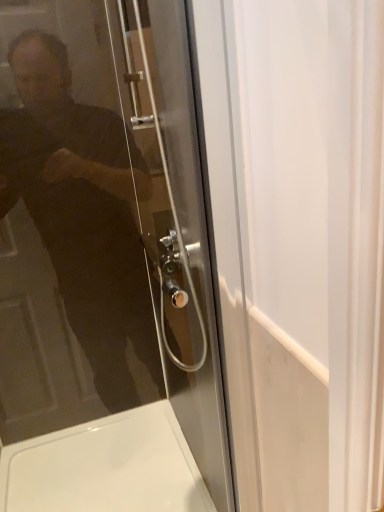
Identify the location of white glossy bath at lower left. (106, 467).

The width and height of the screenshot is (384, 512). Describe the element at coordinates (106, 467) in the screenshot. I see `white glossy bath at lower left` at that location.

In the scene shown: Measure the distance between white glossy bath at lower left and camera.

4.68 feet.

Describe the element at coordinates (104, 260) in the screenshot. I see `transparent glass door at upper left` at that location.

What is the approximate height of transparent glass door at upper left?

The height of transparent glass door at upper left is 1.06 meters.

In order to face transparent glass door at upper left, should I rotate leftwards or rightwards?

Rotate your view left by about 11.130°.

Find the location of `transparent glass door at upper left`. transparent glass door at upper left is located at coordinates (104, 260).

Identify the location of white glossy bath at lower left. (106, 467).

Can you confirm if transparent glass door at upper left is positioned to the left of white glossy bath at lower left?

No, transparent glass door at upper left is not to the left of white glossy bath at lower left.

From the picture: Is transparent glass door at upper left closer to the viewer compared to white glossy bath at lower left?

Yes, transparent glass door at upper left is in front of white glossy bath at lower left.

Considering the positions of point (63, 95) and point (163, 448), is point (63, 95) closer or farther from the camera than point (163, 448)?

Point (63, 95).

From the image's perspective, between transparent glass door at upper left and white glossy bath at lower left, who is located below?

white glossy bath at lower left is shown below in the image.

From a real-world perspective, which object rests below the other?

white glossy bath at lower left.

Can you confirm if transparent glass door at upper left is wider than white glossy bath at lower left?

Incorrect, the width of transparent glass door at upper left does not surpass that of white glossy bath at lower left.

Between transparent glass door at upper left and white glossy bath at lower left, which one has more height?

Standing taller between the two is transparent glass door at upper left.

Is transparent glass door at upper left bigger or smaller than white glossy bath at lower left?

Clearly, transparent glass door at upper left is smaller in size than white glossy bath at lower left.

Would you say transparent glass door at upper left contains white glossy bath at lower left?

That's incorrect, white glossy bath at lower left is not inside transparent glass door at upper left.

Is transparent glass door at upper left placed right next to white glossy bath at lower left?

transparent glass door at upper left is not next to white glossy bath at lower left, and they're not touching.

In the scene shown: Could you tell me if transparent glass door at upper left is turned towards white glossy bath at lower left?

No, transparent glass door at upper left does not turn towards white glossy bath at lower left.

How much distance is there between transparent glass door at upper left and white glossy bath at lower left?

39.12 centimeters.

I want to click on bath below the transparent glass door at upper left (from the image's perspective), so click(106, 467).

Would you say white glossy bath at lower left is to the left or to the right of transparent glass door at upper left in the picture?

In the image, white glossy bath at lower left appears on the left side of transparent glass door at upper left.

Is white glossy bath at lower left positioned in front of transparent glass door at upper left?

No.

Which is nearer, (207, 499) or (67, 210)?

Point (207, 499) appears to be closer to the viewer than point (67, 210).

From the image's perspective, who appears lower, white glossy bath at lower left or transparent glass door at upper left?

white glossy bath at lower left.

Looking at this image, from a real-world perspective, who is located higher, white glossy bath at lower left or transparent glass door at upper left?

transparent glass door at upper left is physically above.

Is white glossy bath at lower left thinner than transparent glass door at upper left?

No, white glossy bath at lower left is not thinner than transparent glass door at upper left.

Considering the sizes of objects white glossy bath at lower left and transparent glass door at upper left in the image provided, who is shorter, white glossy bath at lower left or transparent glass door at upper left?

Standing shorter between the two is white glossy bath at lower left.

Who is smaller, white glossy bath at lower left or transparent glass door at upper left?

transparent glass door at upper left.

Is transparent glass door at upper left surrounded by white glossy bath at lower left?

No, transparent glass door at upper left is not a part of white glossy bath at lower left.

Is white glossy bath at lower left not close to transparent glass door at upper left?

No, white glossy bath at lower left is not far away from transparent glass door at upper left.

Could you tell me if white glossy bath at lower left is facing transparent glass door at upper left?

No, white glossy bath at lower left is not turned towards transparent glass door at upper left.

Can you tell me how much white glossy bath at lower left and transparent glass door at upper left differ in facing direction?

There is a 0.00448-degree angle between the facing directions of white glossy bath at lower left and transparent glass door at upper left.

This screenshot has height=512, width=384. Find the location of `door that appears above the white glossy bath at lower left (from a real-world perspective)`. door that appears above the white glossy bath at lower left (from a real-world perspective) is located at coordinates (104, 260).

Identify the location of bath behind the transparent glass door at upper left. Image resolution: width=384 pixels, height=512 pixels. [x=106, y=467].

Where is `bath below the transparent glass door at upper left (from the image's perspective)`? bath below the transparent glass door at upper left (from the image's perspective) is located at coordinates (106, 467).